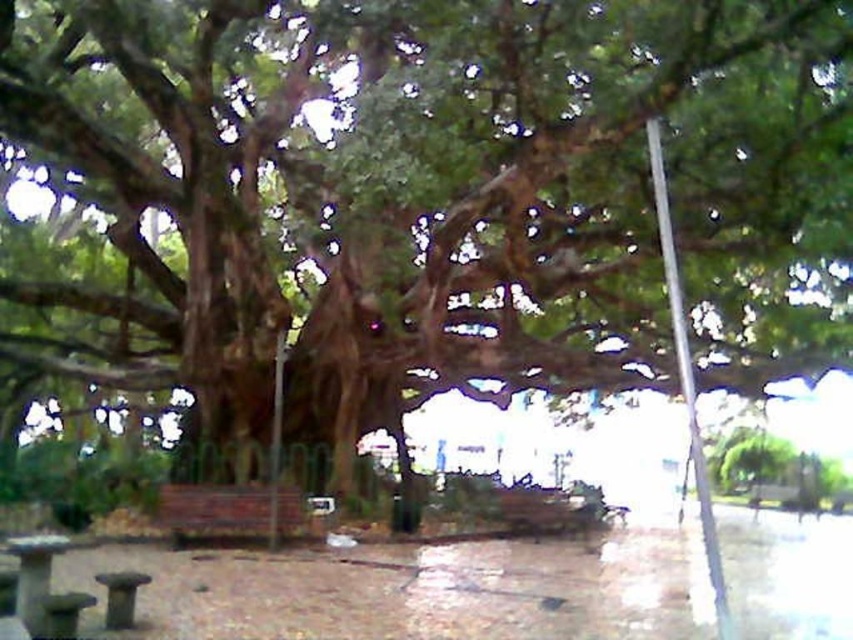
Between brown wooden bench at lower center and wooden picnic table at lower left, which one has less height?

wooden picnic table at lower left is shorter.

Looking at this image, which of these two, brown wooden bench at lower center or wooden picnic table at lower left, stands taller?

With more height is brown wooden bench at lower center.

Is point (175, 499) positioned behind point (32, 602)?

Yes, it is behind point (32, 602).

Find the location of a particular element. brown wooden bench at lower center is located at coordinates (229, 509).

Does wooden picnic table at lower left appear over wooden park bench at lower left?

Yes.

Does wooden picnic table at lower left have a larger size compared to wooden park bench at lower left?

Yes.

Does point (38, 634) come farther from viewer compared to point (119, 602)?

No, (38, 634) is in front of (119, 602).

Where is `wooden picnic table at lower left`? Image resolution: width=853 pixels, height=640 pixels. wooden picnic table at lower left is located at coordinates (44, 589).

Which is more to the left, brown wooden bench at lower center or wooden park bench at lower left?

brown wooden bench at lower center is more to the left.

Who is lower down, brown wooden bench at lower center or wooden park bench at lower left?

brown wooden bench at lower center is below.

Who is more distant from viewer, (163, 499) or (126, 584)?

The point (163, 499) is behind.

Locate an element on the screen. The width and height of the screenshot is (853, 640). brown wooden bench at lower center is located at coordinates (229, 509).